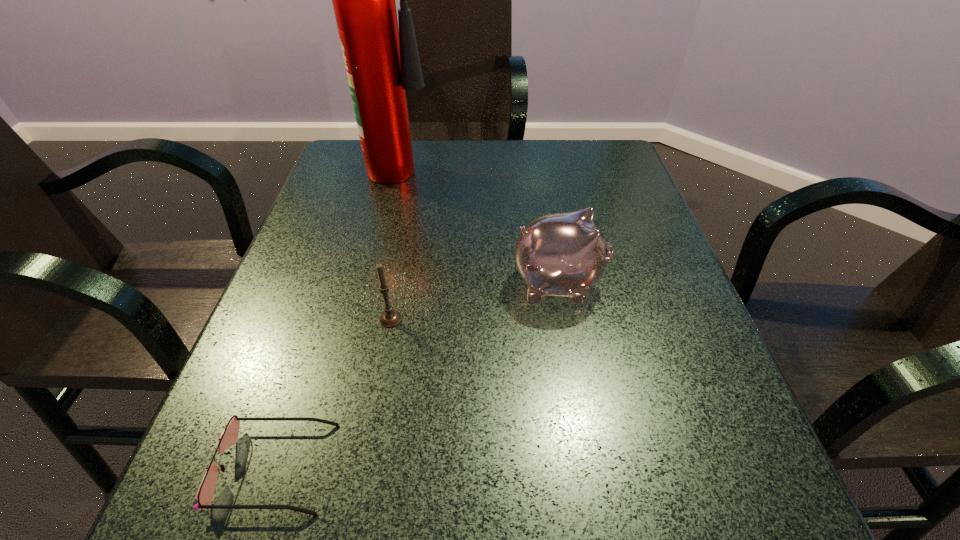
Identify the location of fire extinguisher. The height and width of the screenshot is (540, 960). (382, 62).

This screenshot has height=540, width=960. I want to click on the tallest object, so click(x=382, y=62).

The width and height of the screenshot is (960, 540). What are the coordinates of `piggy bank` in the screenshot? It's located at (563, 254).

In order to click on candle in this screenshot , I will do `click(389, 318)`.

Locate an element on the screen. The image size is (960, 540). the nearest object is located at coordinates (204, 495).

Locate an element on the screen. the shortest object is located at coordinates (204, 495).

I want to click on vacant space located at the nozzle of the farthest object, so click(453, 164).

Locate an element on the screen. The width and height of the screenshot is (960, 540). free space located 0.050m on the front facing side of the piggy bank is located at coordinates point(630,284).

Image resolution: width=960 pixels, height=540 pixels. Identify the location of free space located 0.240m on the front of the second shortest object. (363, 467).

Locate an element on the screen. The width and height of the screenshot is (960, 540). free space located 0.250m on the bridge of the sunglasses is located at coordinates (513, 467).